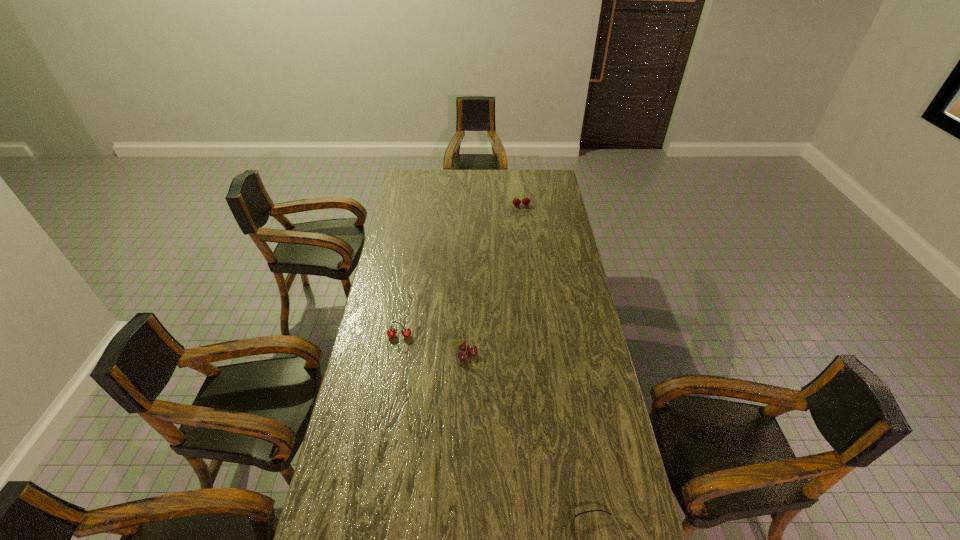
I want to click on the second closest cherry to the nearest object, so click(x=391, y=332).